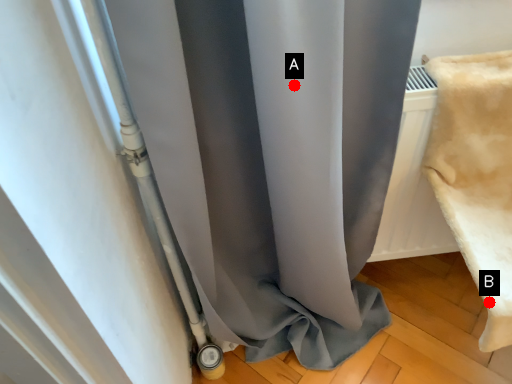
Question: Two points are circled on the image, labeled by A and B beside each circle. Which point is closer to the camera?

Choices:
 (A) A is closer
 (B) B is closer

Answer: (A)